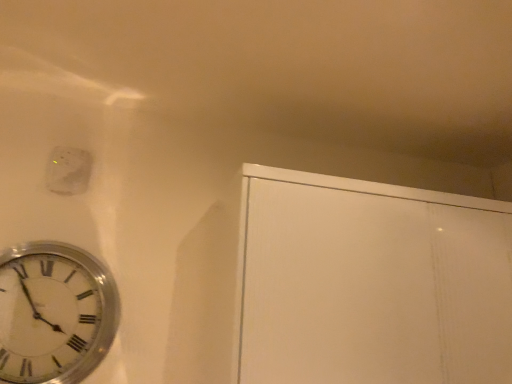
Question: Is point (62, 153) positioned closer to the camera than point (80, 276)?

Choices:
 (A) farther
 (B) closer

Answer: (A)

Question: From their relative heights in the image, would you say white matte electric outlet at upper left is taller or shorter than silver metallic clock at lower left?

Choices:
 (A) short
 (B) tall

Answer: (A)

Question: Based on their relative distances, which object is farther from the silver metallic clock at lower left?

Choices:
 (A) white matte cabinet at upper right
 (B) white matte electric outlet at upper left

Answer: (A)

Question: Which of these objects is positioned closest to the white matte electric outlet at upper left?

Choices:
 (A) white matte cabinet at upper right
 (B) silver metallic clock at lower left

Answer: (B)